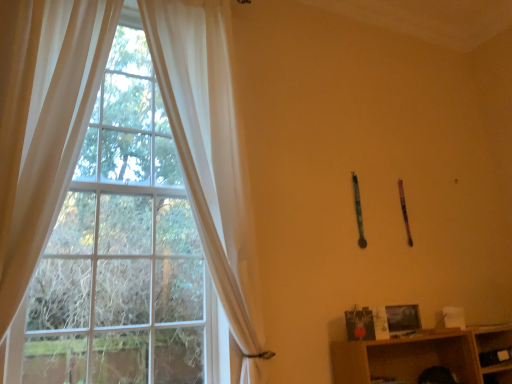
Describe the element at coordinates (42, 122) in the screenshot. This screenshot has height=384, width=512. I see `white sheer curtain at left, the 2th curtain from the right` at that location.

What is the approximate width of white sheer curtain at left, which ranks as the first curtain in left-to-right order?

The width of white sheer curtain at left, which ranks as the first curtain in left-to-right order, is 9.92 inches.

This screenshot has height=384, width=512. Identify the location of white sheer curtain at left, which ranks as the first curtain in left-to-right order. (42, 122).

Find the location of a particular element. This screenshot has height=384, width=512. white sheer curtain at left, arranged as the 2th curtain when viewed from the left is located at coordinates (206, 146).

What do you see at coordinates (206, 146) in the screenshot? I see `white sheer curtain at left, acting as the first curtain starting from the right` at bounding box center [206, 146].

Measure the distance between white sheer curtain at left, acting as the first curtain starting from the right, and camera.

They are 7.08 feet apart.

Locate an element on the screen. This screenshot has width=512, height=384. white sheer curtain at left, the 2th curtain from the right is located at coordinates (x=42, y=122).

Does white sheer curtain at left, the 2th curtain from the right, appear on the right side of white sheer curtain at left, acting as the first curtain starting from the right?

No.

Is white sheer curtain at left, the 2th curtain from the right, behind white sheer curtain at left, arranged as the 2th curtain when viewed from the left?

No, white sheer curtain at left, the 2th curtain from the right, is in front of white sheer curtain at left, arranged as the 2th curtain when viewed from the left.

Does point (59, 77) come farther from viewer compared to point (224, 285)?

No, (59, 77) is closer to viewer.

From the image's perspective, which object appears higher, white sheer curtain at left, the 2th curtain from the right, or white sheer curtain at left, acting as the first curtain starting from the right?

white sheer curtain at left, acting as the first curtain starting from the right, is shown above in the image.

From a real-world perspective, is white sheer curtain at left, the 2th curtain from the right, beneath white sheer curtain at left, acting as the first curtain starting from the right?

Yes, from a real-world perspective, white sheer curtain at left, the 2th curtain from the right, is under white sheer curtain at left, acting as the first curtain starting from the right.

From the picture: Considering the sizes of objects white sheer curtain at left, the 2th curtain from the right, and white sheer curtain at left, arranged as the 2th curtain when viewed from the left, in the image provided, who is wider, white sheer curtain at left, the 2th curtain from the right, or white sheer curtain at left, arranged as the 2th curtain when viewed from the left,?

With larger width is white sheer curtain at left, the 2th curtain from the right.

Who is taller, white sheer curtain at left, the 2th curtain from the right, or white sheer curtain at left, acting as the first curtain starting from the right?

With more height is white sheer curtain at left, acting as the first curtain starting from the right.

Can you confirm if white sheer curtain at left, which ranks as the first curtain in left-to-right order, is smaller than white sheer curtain at left, acting as the first curtain starting from the right?

Indeed, white sheer curtain at left, which ranks as the first curtain in left-to-right order, has a smaller size compared to white sheer curtain at left, acting as the first curtain starting from the right.

Which is correct: white sheer curtain at left, the 2th curtain from the right, is inside white sheer curtain at left, arranged as the 2th curtain when viewed from the left, or outside of it?

white sheer curtain at left, the 2th curtain from the right, is not inside white sheer curtain at left, arranged as the 2th curtain when viewed from the left, it's outside.

Looking at this image, is white sheer curtain at left, the 2th curtain from the right, not near white sheer curtain at left, arranged as the 2th curtain when viewed from the left?

No, there isn't a large distance between white sheer curtain at left, the 2th curtain from the right, and white sheer curtain at left, arranged as the 2th curtain when viewed from the left.

Consider the image. Is white sheer curtain at left, which ranks as the first curtain in left-to-right order, looking in the opposite direction of white sheer curtain at left, acting as the first curtain starting from the right?

That's not correct — white sheer curtain at left, which ranks as the first curtain in left-to-right order, is not looking away from white sheer curtain at left, acting as the first curtain starting from the right.

How many degrees apart are the facing directions of white sheer curtain at left, the 2th curtain from the right, and white sheer curtain at left, arranged as the 2th curtain when viewed from the left?

There is a 0.000103-degree angle between the facing directions of white sheer curtain at left, the 2th curtain from the right, and white sheer curtain at left, arranged as the 2th curtain when viewed from the left.

How distant is white sheer curtain at left, the 2th curtain from the right, from white sheer curtain at left, arranged as the 2th curtain when viewed from the left?

24.08 inches.

The image size is (512, 384). In the image, there is a white sheer curtain at left, arranged as the 2th curtain when viewed from the left. Find the location of `curtain below it (from a real-world perspective)`. curtain below it (from a real-world perspective) is located at coordinates (42, 122).

Would you say white sheer curtain at left, arranged as the 2th curtain when viewed from the left, is to the left or to the right of white sheer curtain at left, which ranks as the first curtain in left-to-right order, in the picture?

From the image, it's evident that white sheer curtain at left, arranged as the 2th curtain when viewed from the left, is to the right of white sheer curtain at left, which ranks as the first curtain in left-to-right order.

In the scene shown: Is white sheer curtain at left, acting as the first curtain starting from the right, behind white sheer curtain at left, the 2th curtain from the right?

Yes, white sheer curtain at left, acting as the first curtain starting from the right, is further from the viewer.

Considering the positions of points (160, 45) and (11, 111), is point (160, 45) closer to camera compared to point (11, 111)?

No.

From the image's perspective, is white sheer curtain at left, acting as the first curtain starting from the right, positioned above or below white sheer curtain at left, which ranks as the first curtain in left-to-right order?

white sheer curtain at left, acting as the first curtain starting from the right, is situated higher than white sheer curtain at left, which ranks as the first curtain in left-to-right order, in the image.

Based on the photo, from a real-world perspective, is white sheer curtain at left, arranged as the 2th curtain when viewed from the left, above or below white sheer curtain at left, which ranks as the first curtain in left-to-right order?

white sheer curtain at left, arranged as the 2th curtain when viewed from the left, is above white sheer curtain at left, which ranks as the first curtain in left-to-right order.

Can you confirm if white sheer curtain at left, acting as the first curtain starting from the right, is thinner than white sheer curtain at left, which ranks as the first curtain in left-to-right order?

Yes, white sheer curtain at left, acting as the first curtain starting from the right, is thinner than white sheer curtain at left, which ranks as the first curtain in left-to-right order.

Is white sheer curtain at left, arranged as the 2th curtain when viewed from the left, taller or shorter than white sheer curtain at left, which ranks as the first curtain in left-to-right order?

white sheer curtain at left, arranged as the 2th curtain when viewed from the left, is taller than white sheer curtain at left, which ranks as the first curtain in left-to-right order.

In the scene shown: Which of these two, white sheer curtain at left, acting as the first curtain starting from the right, or white sheer curtain at left, the 2th curtain from the right, is bigger?

white sheer curtain at left, acting as the first curtain starting from the right.

Would you say white sheer curtain at left, acting as the first curtain starting from the right, is outside white sheer curtain at left, the 2th curtain from the right?

Yes, white sheer curtain at left, acting as the first curtain starting from the right, is outside of white sheer curtain at left, the 2th curtain from the right.

Consider the image. Is white sheer curtain at left, arranged as the 2th curtain when viewed from the left, far away from white sheer curtain at left, the 2th curtain from the right?

That's not correct — white sheer curtain at left, arranged as the 2th curtain when viewed from the left, is a little close to white sheer curtain at left, the 2th curtain from the right.

Is white sheer curtain at left, acting as the first curtain starting from the right, positioned with its back to white sheer curtain at left, the 2th curtain from the right?

white sheer curtain at left, acting as the first curtain starting from the right, is not turned away from white sheer curtain at left, the 2th curtain from the right.

Can you tell me how much white sheer curtain at left, arranged as the 2th curtain when viewed from the left, and white sheer curtain at left, the 2th curtain from the right, differ in facing direction?

0.000103 degrees separate the facing orientations of white sheer curtain at left, arranged as the 2th curtain when viewed from the left, and white sheer curtain at left, the 2th curtain from the right.

Where is `curtain that appears above the white sheer curtain at left, which ranks as the first curtain in left-to-right order (from the image's perspective)`? The width and height of the screenshot is (512, 384). curtain that appears above the white sheer curtain at left, which ranks as the first curtain in left-to-right order (from the image's perspective) is located at coordinates (206, 146).

Find the location of a particular element. This screenshot has height=384, width=512. curtain located behind the white sheer curtain at left, which ranks as the first curtain in left-to-right order is located at coordinates click(x=206, y=146).

Where is `curtain on the left of white sheer curtain at left, arranged as the 2th curtain when viewed from the left`? This screenshot has width=512, height=384. curtain on the left of white sheer curtain at left, arranged as the 2th curtain when viewed from the left is located at coordinates (42, 122).